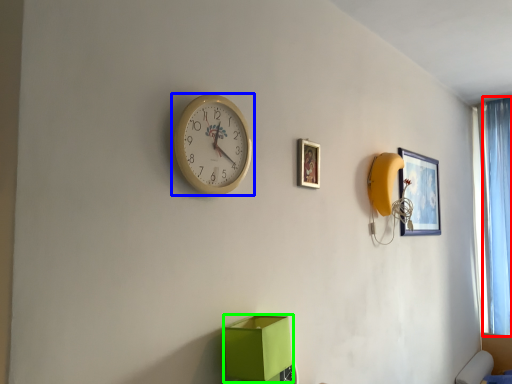
Question: Considering the real-world distances, which object is closest to curtain (highlighted by a red box)? wall clock (highlighted by a blue box) or cardboard box (highlighted by a green box).

Choices:
 (A) wall clock
 (B) cardboard box

Answer: (B)